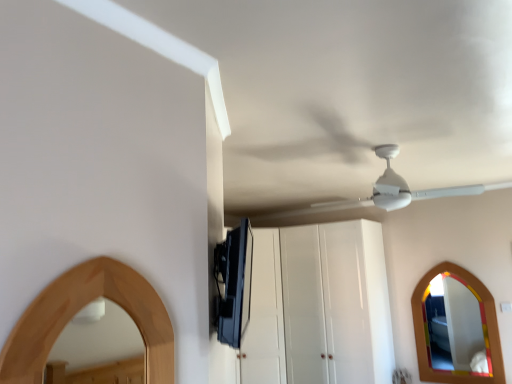
Question: From the image's perspective, is white matte fan at upper center above or below wooden mirror at lower right?

Choices:
 (A) above
 (B) below

Answer: (A)

Question: Looking at the image, does white matte fan at upper center seem bigger or smaller compared to wooden mirror at lower right?

Choices:
 (A) small
 (B) big

Answer: (B)

Question: Based on their relative distances, which object is nearer to the wooden mirror at lower right?

Choices:
 (A) white glossy cabinet at center
 (B) white matte fan at upper center
 (C) satin black tv at upper center

Answer: (A)

Question: Which object is the farthest from the satin black tv at upper center?

Choices:
 (A) white matte fan at upper center
 (B) white glossy cabinet at center
 (C) wooden mirror at lower right

Answer: (C)